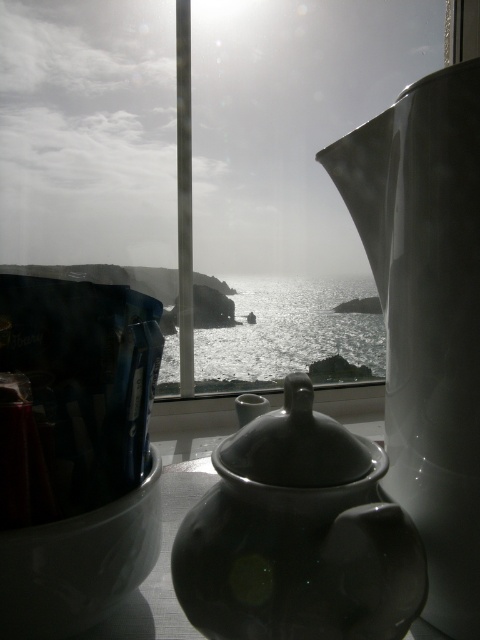
Can you confirm if matte black teapot at center is positioned to the right of glistening silver water at center?

No, matte black teapot at center is not to the right of glistening silver water at center.

How much distance is there between matte black teapot at center and glistening silver water at center?

matte black teapot at center and glistening silver water at center are 1.96 meters apart from each other.

Identify the location of matte black teapot at center. This screenshot has height=640, width=480. (299, 536).

Between white glossy teapot at right and matte black teapot at center, which one has less height?

With less height is matte black teapot at center.

Can you confirm if white glossy teapot at right is taller than matte black teapot at center?

Indeed, white glossy teapot at right has a greater height compared to matte black teapot at center.

The image size is (480, 640). Identify the location of white glossy teapot at right. (428, 316).

This screenshot has height=640, width=480. What do you see at coordinates (207, 170) in the screenshot?
I see `transparent glass window at center` at bounding box center [207, 170].

Between point (327, 262) and point (451, 422), which one is positioned in front?

Point (451, 422) is in front.

Who is more forward, (87, 108) or (386, 433)?

Point (386, 433) is more forward.

Identify the location of transparent glass window at center. (207, 170).